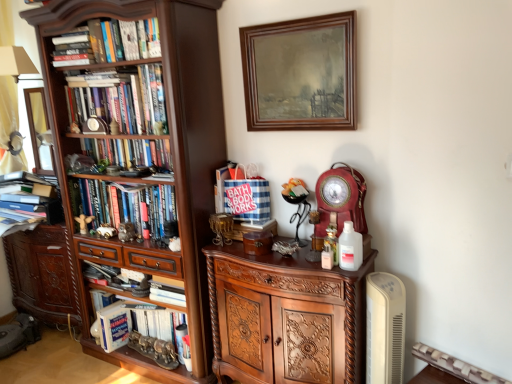
Describe the element at coordinates (341, 199) in the screenshot. This screenshot has width=512, height=384. I see `matte red clock at center-right` at that location.

At what (x,y) coordinates should I click in order to perform the action: click on brown carved cabinet at lower left, which is the 2th cabinetry in front-to-back order. Please return your answer as a coordinate pair (x, y). This screenshot has width=512, height=384. Looking at the image, I should click on (42, 274).

Find the location of `matte red clock at center-right`. matte red clock at center-right is located at coordinates (341, 199).

Is hardcover book at lower left, the 5th book from the top, at the back of metallic silver radiator at lower right?

No, metallic silver radiator at lower right's orientation is not away from hardcover book at lower left, the 5th book from the top.

Does point (486, 383) come closer to viewer compared to point (106, 331)?

Yes, it is in front of point (106, 331).

Is metallic silver radiator at lower right thinner than hardcover book at lower left, which is counted as the first book, starting from the bottom?

Indeed, metallic silver radiator at lower right has a lesser width compared to hardcover book at lower left, which is counted as the first book, starting from the bottom.

From a real-world perspective, is metallic silver radiator at lower right physically below hardcover book at lower left, which is counted as the first book, starting from the bottom?

Actually, metallic silver radiator at lower right is physically above hardcover book at lower left, which is counted as the first book, starting from the bottom, in the real world.

Can you tell me how much hardcover book at left, positioned as the second book in bottom-to-top order, and wooden picture frame at upper center differ in facing direction?

The facing directions of hardcover book at left, positioned as the second book in bottom-to-top order, and wooden picture frame at upper center are 1.09 degrees apart.

Does hardcover book at left, positioned as the second book in bottom-to-top order, turn towards wooden picture frame at upper center?

No, hardcover book at left, positioned as the second book in bottom-to-top order, is not oriented towards wooden picture frame at upper center.

Considering the relative sizes of hardcover book at left, the 4th book from the top, and wooden picture frame at upper center in the image provided, is hardcover book at left, the 4th book from the top, wider than wooden picture frame at upper center?

Indeed, hardcover book at left, the 4th book from the top, has a greater width compared to wooden picture frame at upper center.

Measure the distance between hardcover book at left, positioned as the second book in bottom-to-top order, and wooden picture frame at upper center.

hardcover book at left, positioned as the second book in bottom-to-top order, and wooden picture frame at upper center are 35.02 inches apart from each other.

This screenshot has height=384, width=512. In order to click on the 2nd cabinetry below the plaid fabric bag at center, the 3th book when ordered from top to bottom (from the image's perspective) in this screenshot , I will do `click(285, 318)`.

Is plaid fabric bag at center, the 3th book when ordered from top to bottom, facing towards polished wood cabinet at center, acting as the 1th cabinetry starting from the front?

No.

Are plaid fabric bag at center, acting as the 3th book starting from the bottom, and polished wood cabinet at center, acting as the 1th cabinetry starting from the front, far apart?

No.

Looking at this image, is plaid fabric bag at center, the 3th book when ordered from top to bottom, positioned behind polished wood cabinet at center, the 2th cabinetry from the back?

Yes, plaid fabric bag at center, the 3th book when ordered from top to bottom, is further from the viewer.

From the image's perspective, is dark wood bookcase at left located above hardcover book at left, the 4th book from the top?

Yes, from the image's perspective, dark wood bookcase at left is above hardcover book at left, the 4th book from the top.

Who is taller, dark wood bookcase at left or hardcover book at left, positioned as the second book in bottom-to-top order?

dark wood bookcase at left.

Which is behind, point (215, 73) or point (92, 224)?

Point (92, 224)

Does dark wood bookcase at left have a larger size compared to hardcover book at left, the 4th book from the top?

Yes.

Is matte red clock at center-right in front of hardcover book at lower left?

Yes, matte red clock at center-right is closer to the viewer.

Is point (350, 203) closer or farther from the camera than point (112, 321)?

Point (350, 203).

Which is correct: matte red clock at center-right is inside hardcover book at lower left, or outside of it?

matte red clock at center-right exists outside the volume of hardcover book at lower left.

Which of these two, matte red clock at center-right or hardcover book at lower left, is wider?

Wider between the two is hardcover book at lower left.

Which of these two, polished wood cabinet at center, which appears as the 2th cabinetry when viewed from the left, or hardcover books at left, the 2th book when ordered from top to bottom, is bigger?

polished wood cabinet at center, which appears as the 2th cabinetry when viewed from the left, is bigger.

Consider the image. From a real-world perspective, is polished wood cabinet at center, acting as the 1th cabinetry starting from the front, beneath hardcover books at left, the 4th book from the bottom?

Indeed, from a real-world perspective, polished wood cabinet at center, acting as the 1th cabinetry starting from the front, is positioned beneath hardcover books at left, the 4th book from the bottom.

Considering the sizes of polished wood cabinet at center, which appears as the 2th cabinetry when viewed from the left, and hardcover books at left, the 2th book when ordered from top to bottom, in the image, is polished wood cabinet at center, which appears as the 2th cabinetry when viewed from the left, wider or thinner than hardcover books at left, the 2th book when ordered from top to bottom,?

In the image, polished wood cabinet at center, which appears as the 2th cabinetry when viewed from the left, appears to be wider than hardcover books at left, the 2th book when ordered from top to bottom.

Based on the photo, does plaid fabric bag at center, acting as the 3th book starting from the bottom, appear on the right side of dark wood bookcase at left?

Yes.

Which book is the 2nd one when counting from the right side of the dark wood bookcase at left? Please provide its 2D coordinates.

[(242, 195)]

Would you consider plaid fabric bag at center, acting as the 3th book starting from the bottom, to be distant from dark wood bookcase at left?

They are positioned close to each other.

From their relative heights in the image, would you say plaid fabric bag at center, the 3th book when ordered from top to bottom, is taller or shorter than dark wood bookcase at left?

Considering their sizes, plaid fabric bag at center, the 3th book when ordered from top to bottom, has less height than dark wood bookcase at left.

Locate an element on the screen. This screenshot has height=384, width=512. radiator in front of the hardcover book at lower left, which is counted as the first book, starting from the bottom is located at coordinates (455, 366).

Starting from the wooden picture frame at upper center, which book is the 3rd one behind? Please provide its 2D coordinates.

[(125, 205)]

From the image, which object appears to be farther from dark wood bookcase at left, matte red clock at center-right or hardcover books at left, the 4th book from the bottom?

matte red clock at center-right lies further to dark wood bookcase at left than the other object.

Estimate the real-world distances between objects in this image. Which object is closer to dark wood bookcase at left, plaid fabric bag at center, the 3th book when ordered from top to bottom, or matte red clock at center-right?

Among the two, plaid fabric bag at center, the 3th book when ordered from top to bottom, is located nearer to dark wood bookcase at left.

Looking at the image, which one is located further to hardcover books at center, arranged as the 5th book when ordered from the bottom, hardcover book at lower left, the 5th book from the top, or plaid fabric bag at center, acting as the 3th book starting from the bottom?

The object further to hardcover books at center, arranged as the 5th book when ordered from the bottom, is hardcover book at lower left, the 5th book from the top.

Estimate the real-world distances between objects in this image. Which object is further from hardcover book at lower left, metallic silver radiator at lower right or dark wood bookcase at left?

metallic silver radiator at lower right is further to hardcover book at lower left.

Which object lies further to the anchor point brown carved cabinet at lower left, marked as the first cabinetry in a left-to-right arrangement, hardcover book at lower left, which is counted as the first book, starting from the bottom, or plaid fabric bag at center, the 3th book when ordered from top to bottom?

Among the two, plaid fabric bag at center, the 3th book when ordered from top to bottom, is located further to brown carved cabinet at lower left, marked as the first cabinetry in a left-to-right arrangement.

Which object lies nearer to the anchor point hardcover books at center, arranged as the 5th book when ordered from the bottom, wooden picture frame at upper center or matte red clock at center-right?

Based on the image, wooden picture frame at upper center appears to be nearer to hardcover books at center, arranged as the 5th book when ordered from the bottom.

Estimate the real-world distances between objects in this image. Which object is closer to wooden picture frame at upper center, plaid fabric bag at center, the 3th book when ordered from top to bottom, or hardcover book at lower left?

The object closer to wooden picture frame at upper center is plaid fabric bag at center, the 3th book when ordered from top to bottom.

Estimate the real-world distances between objects in this image. Which object is further from hardcover books at left, the 2th book when ordered from top to bottom, metallic silver radiator at lower right or brown carved cabinet at lower left, which is the 2th cabinetry in front-to-back order?

The object further to hardcover books at left, the 2th book when ordered from top to bottom, is metallic silver radiator at lower right.

Where is `cabinetry between hardcover book at lower left, which is counted as the first book, starting from the bottom, and metallic silver radiator at lower right, in the horizontal direction`? The height and width of the screenshot is (384, 512). cabinetry between hardcover book at lower left, which is counted as the first book, starting from the bottom, and metallic silver radiator at lower right, in the horizontal direction is located at coordinates (285, 318).

Find the location of a particular element. bookcase located between hardcover books at left, the 4th book from the bottom, and wooden picture frame at upper center in the left-right direction is located at coordinates (152, 139).

Locate an element on the screen. The width and height of the screenshot is (512, 384). cabinetry located between hardcover book at left, the 4th book from the top, and matte red clock at center-right in the left-right direction is located at coordinates (285, 318).

Find the location of `book between hardcover book at left, the 4th book from the top, and hardcover book at lower left in the up-down direction`. book between hardcover book at left, the 4th book from the top, and hardcover book at lower left in the up-down direction is located at coordinates (141, 330).